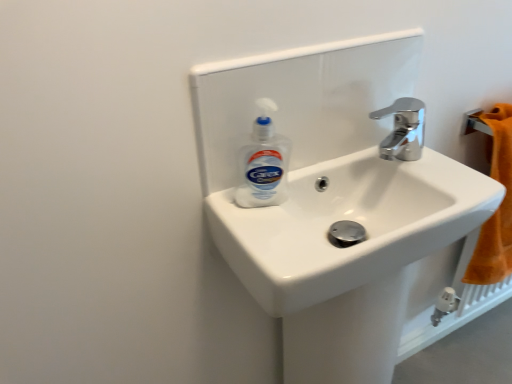
Question: Is white glossy sink at center thinner than white plastic bottle at center?

Choices:
 (A) no
 (B) yes

Answer: (A)

Question: Is the position of white glossy sink at center more distant than that of white plastic bottle at center?

Choices:
 (A) no
 (B) yes

Answer: (A)

Question: Does white glossy sink at center have a smaller size compared to white plastic bottle at center?

Choices:
 (A) yes
 (B) no

Answer: (B)

Question: Is white glossy sink at center looking in the opposite direction of white plastic bottle at center?

Choices:
 (A) yes
 (B) no

Answer: (B)

Question: Is white plastic bottle at center surrounded by white glossy sink at center?

Choices:
 (A) yes
 (B) no

Answer: (B)

Question: Considering the relative positions of white glossy sink at center and white plastic bottle at center in the image provided, is white glossy sink at center to the left of white plastic bottle at center from the viewer's perspective?

Choices:
 (A) no
 (B) yes

Answer: (A)

Question: Would you say white glossy sink at center is part of white plastic bottle at center's contents?

Choices:
 (A) no
 (B) yes

Answer: (A)

Question: Considering the relative sizes of white plastic bottle at center and white glossy sink at center in the image provided, is white plastic bottle at center smaller than white glossy sink at center?

Choices:
 (A) yes
 (B) no

Answer: (A)

Question: From the image's perspective, is white plastic bottle at center on top of white glossy sink at center?

Choices:
 (A) yes
 (B) no

Answer: (A)

Question: Would you consider white plastic bottle at center to be distant from white glossy sink at center?

Choices:
 (A) yes
 (B) no

Answer: (B)

Question: Is white plastic bottle at center closer to camera compared to white glossy sink at center?

Choices:
 (A) no
 (B) yes

Answer: (A)

Question: Is white plastic bottle at center to the right of white glossy sink at center from the viewer's perspective?

Choices:
 (A) no
 (B) yes

Answer: (A)

Question: Is chrome metallic faucet at upper right taller than white glossy sink at center?

Choices:
 (A) yes
 (B) no

Answer: (B)